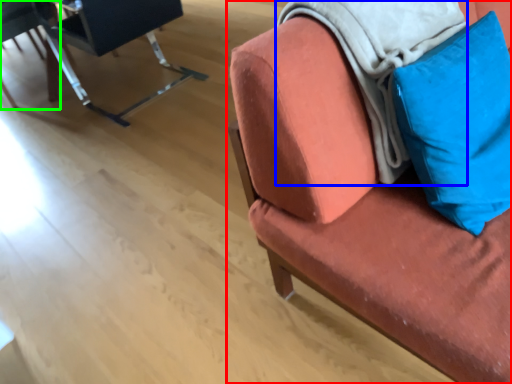
Question: Based on their relative distances, which object is nearer to chair (highlighted by a red box)? Choose from blanket (highlighted by a blue box) and chair (highlighted by a green box).

Choices:
 (A) blanket
 (B) chair

Answer: (A)